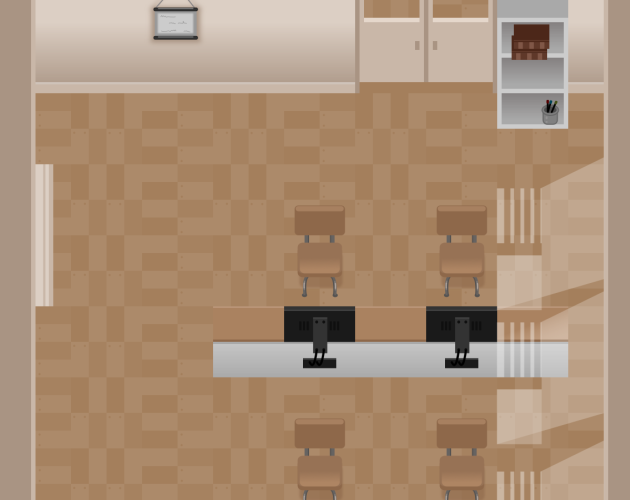
The image size is (630, 500). In order to click on certificate hanging on the wall in this screenshot , I will do (x=169, y=22).